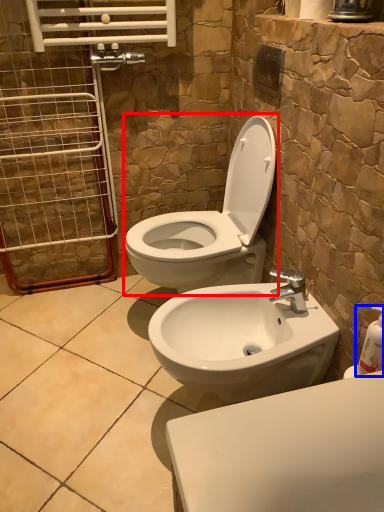
Question: Which object is closer to the camera taking this photo, toilet (highlighted by a red box) or soap dispenser (highlighted by a blue box)?

Choices:
 (A) toilet
 (B) soap dispenser

Answer: (B)